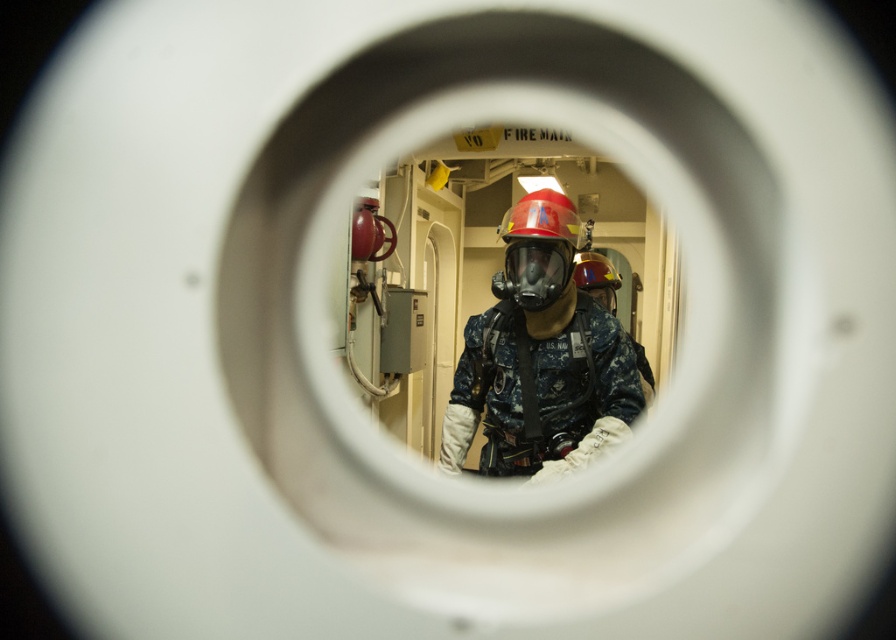
Question: Can you confirm if shiny red helmet at center is positioned above matte black helmet at center?

Choices:
 (A) no
 (B) yes

Answer: (B)

Question: Does shiny red helmet at center appear on the right side of matte black helmet at center?

Choices:
 (A) no
 (B) yes

Answer: (A)

Question: Among these objects, which one is nearest to the camera?

Choices:
 (A) shiny red helmet at center
 (B) blue camouflage uniform at center
 (C) matte black helmet at center

Answer: (B)

Question: Which point is closer to the camera?

Choices:
 (A) (464, 401)
 (B) (619, 276)
 (C) (531, 218)

Answer: (C)

Question: Which of the following is the closest to the observer?

Choices:
 (A) shiny red helmet at center
 (B) matte black helmet at center

Answer: (A)

Question: Does blue camouflage uniform at center appear on the right side of shiny red helmet at center?

Choices:
 (A) no
 (B) yes

Answer: (A)